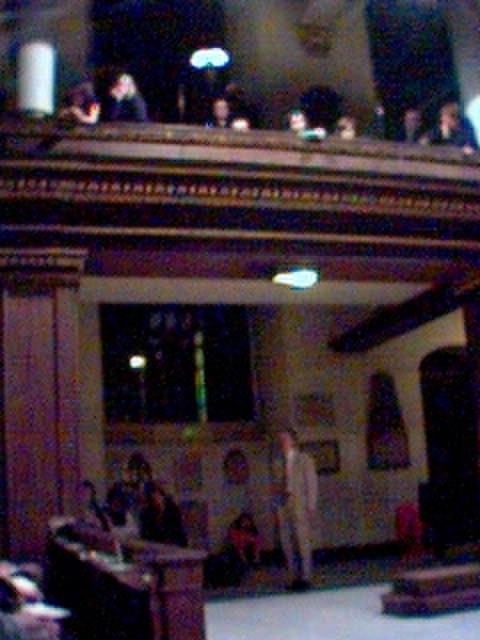
Who is more distant from viewer, (285, 481) or (132, 115)?

Positioned behind is point (285, 481).

Which of these two, light beige pants at center or matte black suit at upper center, stands shorter?

Standing shorter between the two is matte black suit at upper center.

Is point (278, 442) closer to viewer compared to point (141, 104)?

No, (278, 442) is further to viewer.

Find the location of a particular element. This screenshot has width=480, height=640. light beige pants at center is located at coordinates (294, 504).